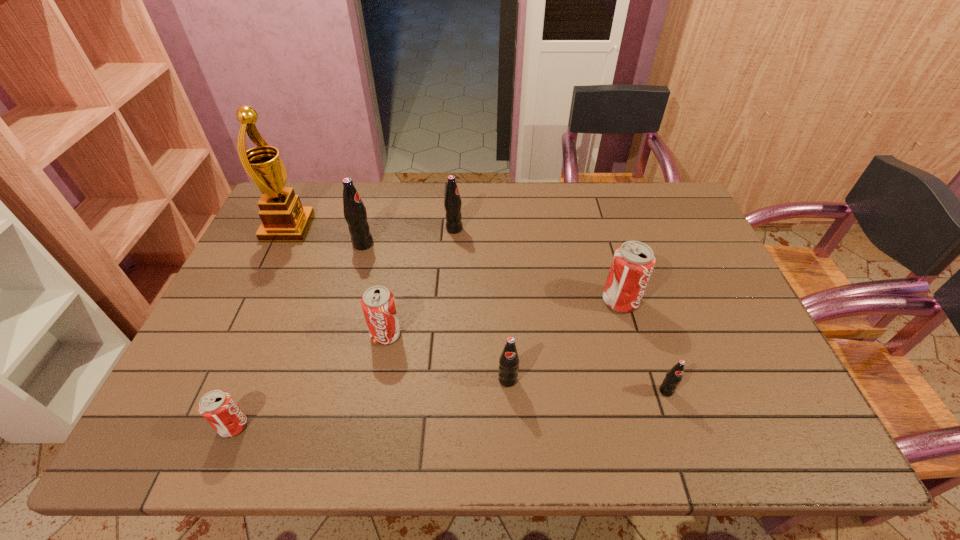
This screenshot has height=540, width=960. I want to click on vacant region at the far edge of the desktop, so click(572, 185).

Identify the location of vacant space at the near edge. This screenshot has width=960, height=540. (590, 442).

The image size is (960, 540). I want to click on free space at the left edge, so click(181, 386).

Identify the location of vacant space at the right edge of the desktop. Image resolution: width=960 pixels, height=540 pixels. [762, 370].

Find the location of a particular element. free spot between the second pink soda can from right to left and the third soda can from right to left is located at coordinates (446, 357).

This screenshot has width=960, height=540. Identify the location of free space between the rightmost black pop and the award. (477, 309).

Locate an element on the screen. The height and width of the screenshot is (540, 960). free spot between the rightmost black pop and the gold award is located at coordinates (477, 309).

This screenshot has width=960, height=540. I want to click on vacant area that lies between the third black pop from left to right and the biggest black pop, so click(436, 312).

The image size is (960, 540). I want to click on free spot between the sixth object from right to left and the leftmost soda can, so click(299, 335).

This screenshot has height=540, width=960. I want to click on free area in between the smallest black pop and the farthest black pop, so click(x=561, y=310).